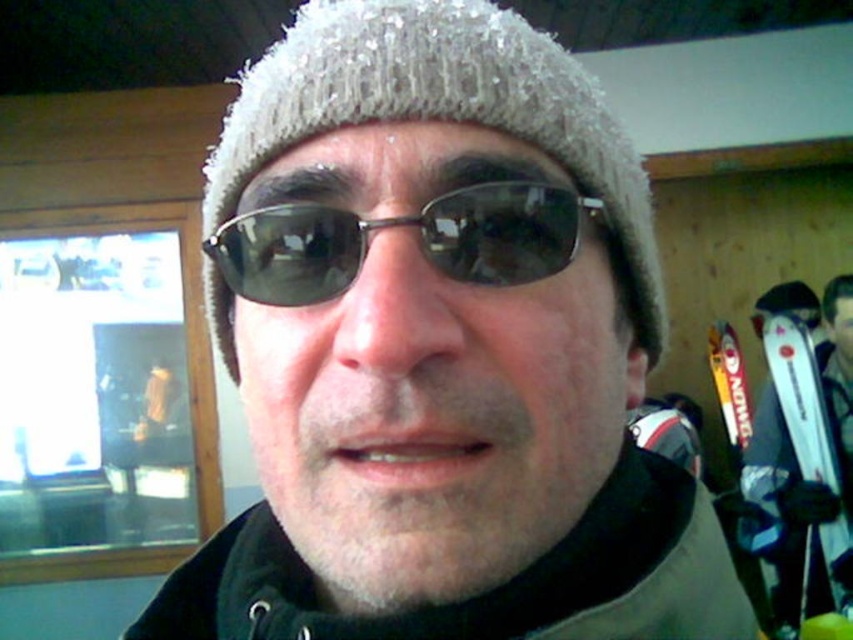
Question: Among these objects, which one is farthest from the camera?

Choices:
 (A) white glossy ski at right
 (B) sunglasses at center

Answer: (A)

Question: Is sunglasses at center below white glossy ski at right?

Choices:
 (A) yes
 (B) no

Answer: (B)

Question: Considering the relative positions of sunglasses at center and white glossy ski at right in the image provided, where is sunglasses at center located with respect to white glossy ski at right?

Choices:
 (A) below
 (B) above

Answer: (B)

Question: Is sunglasses at center further to camera compared to white glossy ski at right?

Choices:
 (A) no
 (B) yes

Answer: (A)